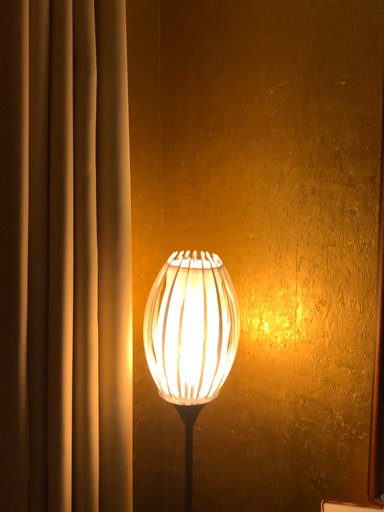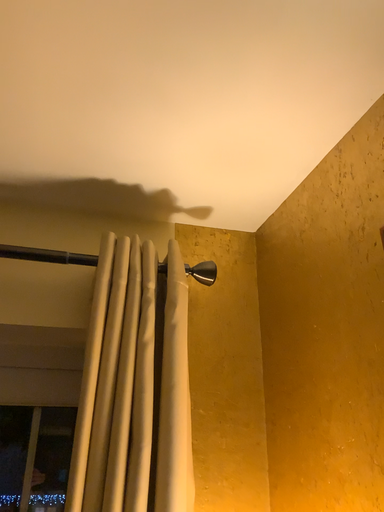
Question: How did the camera likely rotate when shooting the video?

Choices:
 (A) rotated right
 (B) rotated left

Answer: (B)